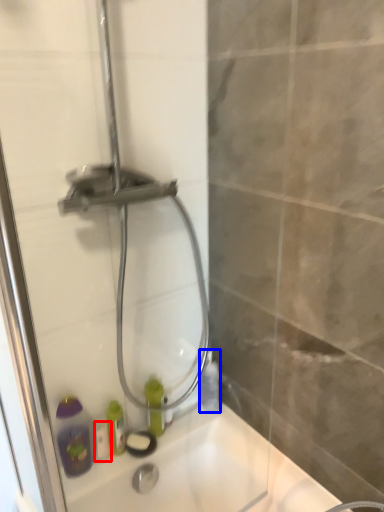
Question: Which object is closer to the camera taking this photo, toiletry (highlighted by a red box) or bottle (highlighted by a blue box)?

Choices:
 (A) toiletry
 (B) bottle

Answer: (A)